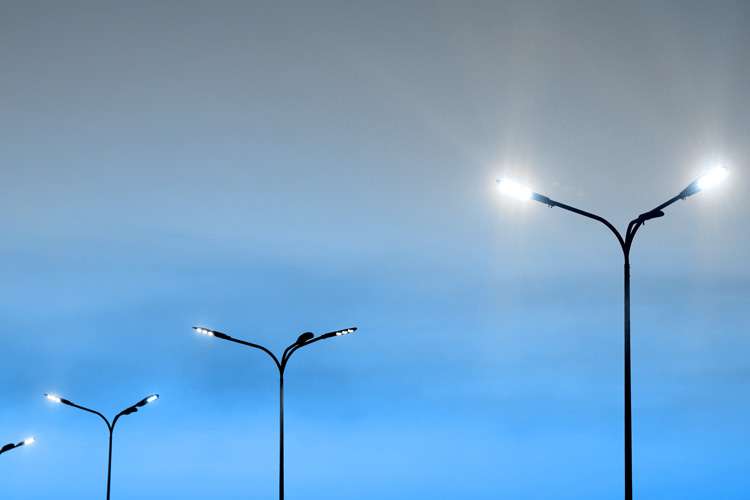
Where is `light`? light is located at coordinates (514, 187).